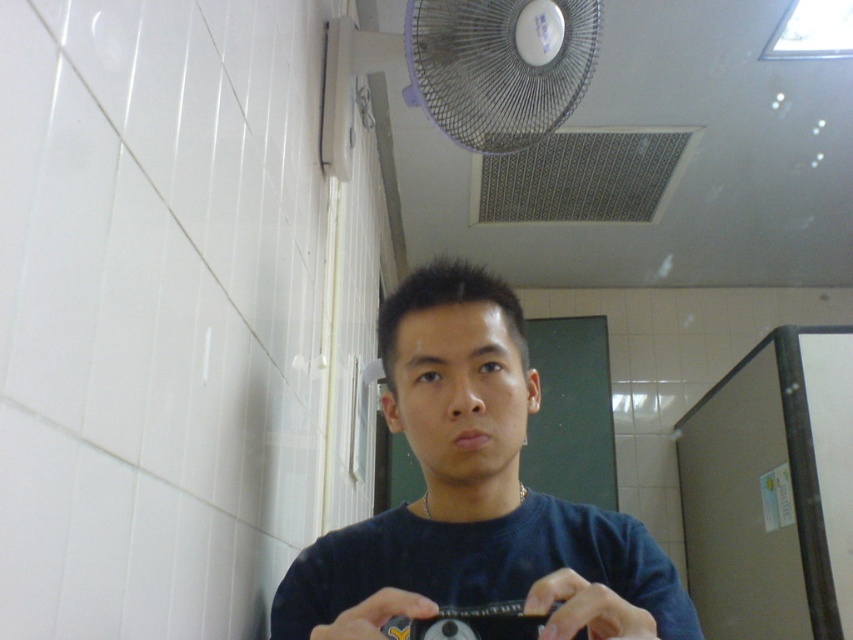
Question: Can you confirm if white plastic fan at upper center is positioned above black plastic camera at center?

Choices:
 (A) no
 (B) yes

Answer: (B)

Question: Which point is farther to the camera?

Choices:
 (A) dark blue t-shirt at center
 (B) black plastic camera at center
 (C) white plastic fan at upper center

Answer: (C)

Question: Is white plastic fan at upper center above black plastic camera at center?

Choices:
 (A) no
 (B) yes

Answer: (B)

Question: Is dark blue t-shirt at center positioned in front of black plastic camera at center?

Choices:
 (A) no
 (B) yes

Answer: (B)

Question: Which of the following is the farthest from the observer?

Choices:
 (A) (579, 49)
 (B) (679, 620)

Answer: (A)

Question: Which point is closer to the camera?

Choices:
 (A) (573, 35)
 (B) (407, 621)
 (C) (593, 609)

Answer: (C)